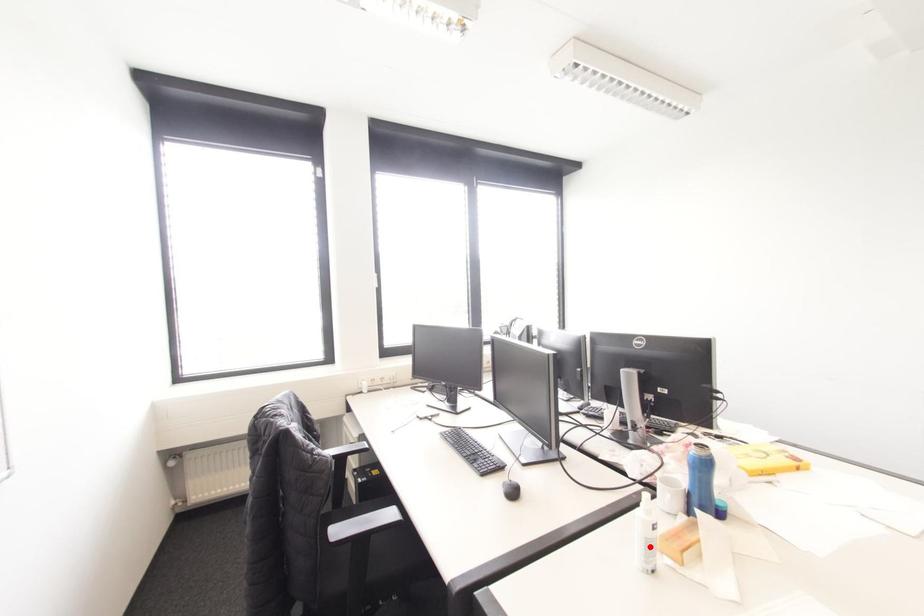
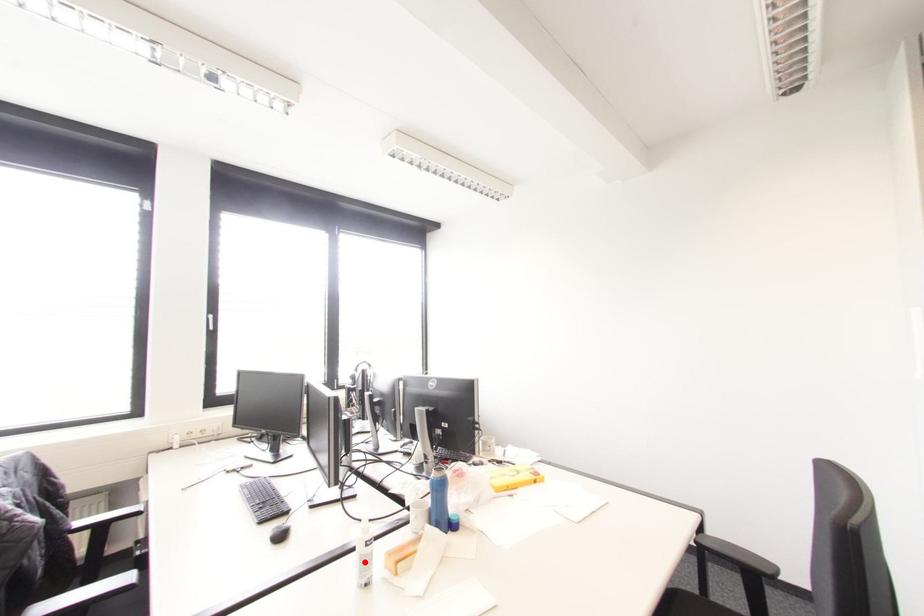
I am providing you with two images of the same scene from different viewpoints. A red point is marked on the first image and another point is marked on the second image. Does the point marked in image1 correspond to the same location as the one in image2?

Yes